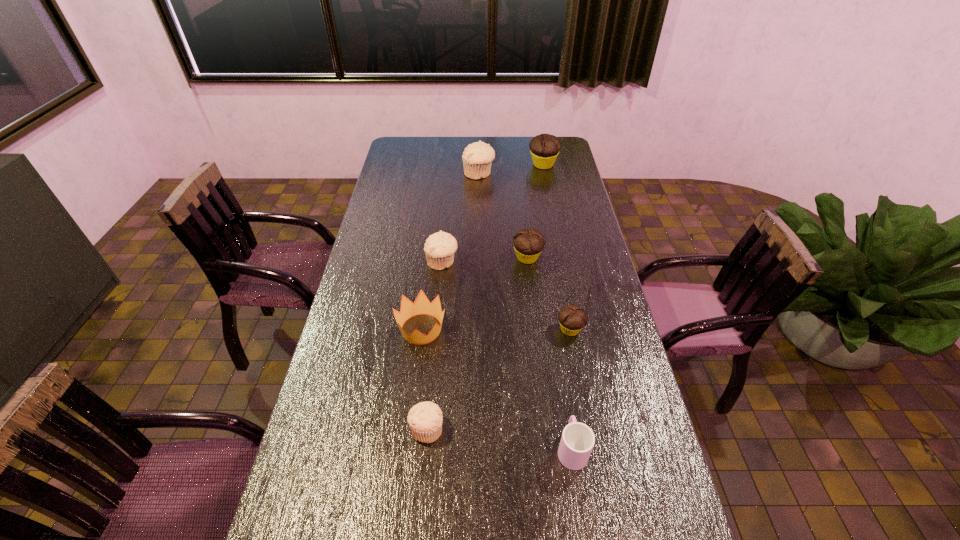
At what (x,y) coordinates should I click in order to perform the action: click on vacant area situated 0.080m on the back of the farthest beige muffin. Please return your answer as a coordinate pair (x, y). Looking at the image, I should click on (479, 157).

The width and height of the screenshot is (960, 540). Identify the location of vacant space positioned 0.120m on the front of the biggest chocolate muffin. (548, 187).

This screenshot has width=960, height=540. In order to click on vacant space positioned on the right of the second smallest beige muffin in this screenshot , I will do point(527,262).

The width and height of the screenshot is (960, 540). I want to click on vacant space situated on the back of the second nearest chocolate muffin, so [521, 203].

Locate an element on the screen. vacant space located on the right of the crown is located at coordinates (575, 329).

Locate an element on the screen. vacant region located 0.290m with the handle on the side of the cup is located at coordinates (555, 339).

The image size is (960, 540). Find the location of `vacant space located with the handle on the side of the cup`. vacant space located with the handle on the side of the cup is located at coordinates (557, 352).

Find the location of a particular element. The image size is (960, 540). vacant space located 0.330m with the handle on the side of the cup is located at coordinates (553, 328).

The width and height of the screenshot is (960, 540). I want to click on vacant position located 0.240m on the back of the nearest beige muffin, so click(x=435, y=341).

Find the location of a particular element. The height and width of the screenshot is (540, 960). free region located on the front of the nearest chocolate muffin is located at coordinates (577, 363).